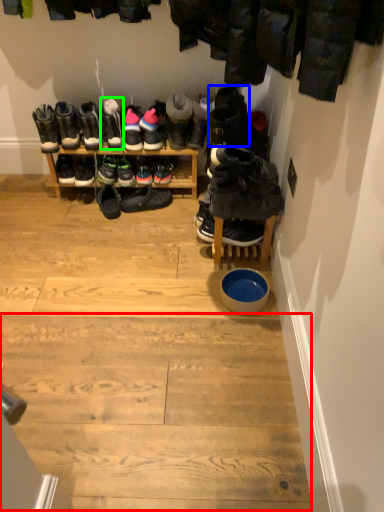
Question: Which object is positioned closest to stair (highlighted by a red box)? Select from footwear (highlighted by a blue box) and footwear (highlighted by a green box).

Choices:
 (A) footwear
 (B) footwear

Answer: (A)